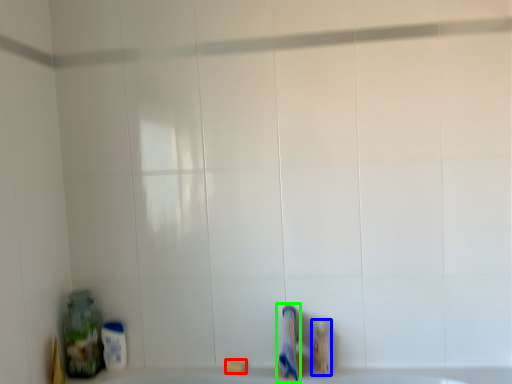
Question: Which is farther away from soap (highlighted by a red box)? toiletry (highlighted by a blue box) or toothpaste (highlighted by a green box)?

Choices:
 (A) toiletry
 (B) toothpaste

Answer: (A)